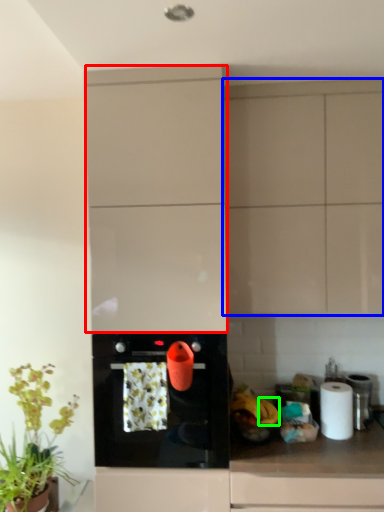
Question: Estimate the real-world distances between objects in this image. Which object is farther from cabinetry (highlighted by a red box), cabinetry (highlighted by a blue box) or banana (highlighted by a green box)?

Choices:
 (A) cabinetry
 (B) banana

Answer: (B)